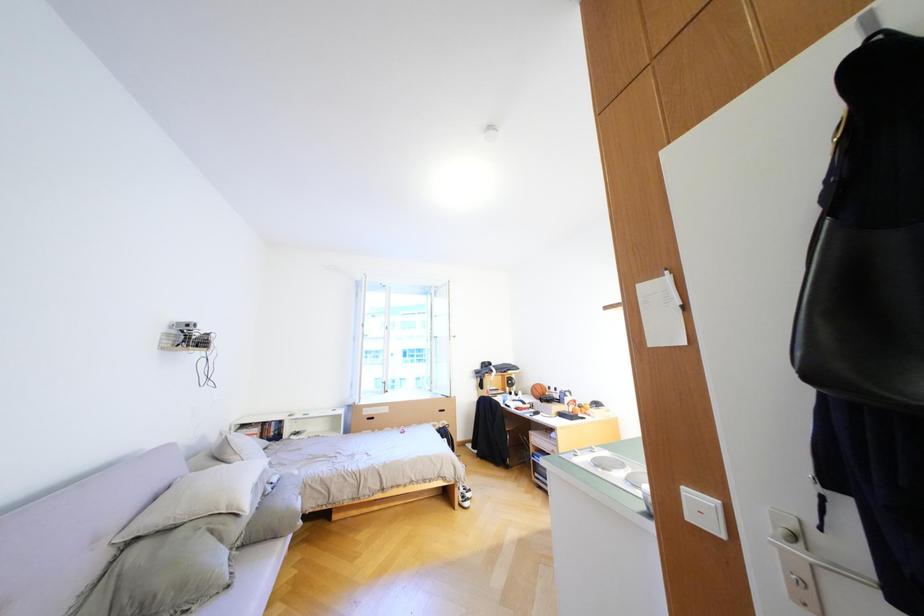
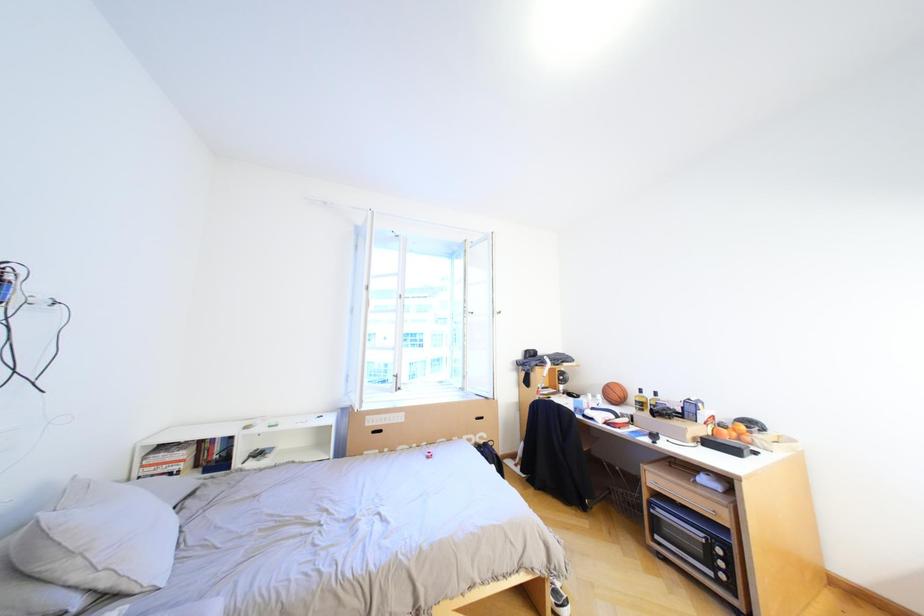
What movement of the cameraman would produce the second image?

The cameraman walked toward left, forward.